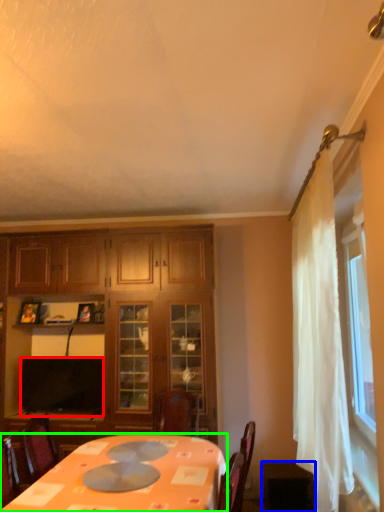
Question: Which object is the farthest from television (highlighted by a red box)? Choose among these: table (highlighted by a blue box) or desk (highlighted by a green box).

Choices:
 (A) table
 (B) desk

Answer: (A)